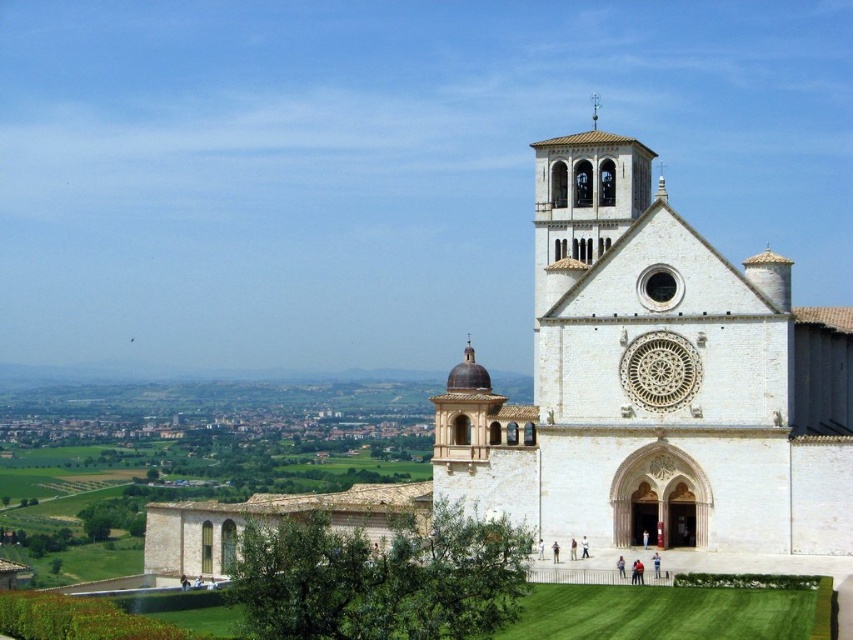
Find the location of `white stone church at right`. white stone church at right is located at coordinates (656, 380).

Measure the distance between white stone church at right and camera.

white stone church at right is 283.28 feet from camera.

Identify the location of white stone church at right. Image resolution: width=853 pixels, height=640 pixels. (656, 380).